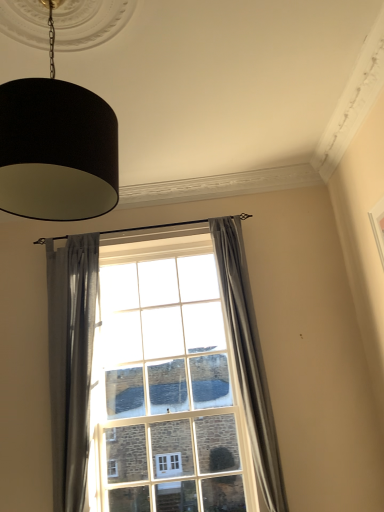
Question: From the image's perspective, is satin gray curtain at left, which is the second curtain in right-to-left order, located beneath gray fabric curtain at center, which is the first curtain in right-to-left order?

Choices:
 (A) no
 (B) yes

Answer: (B)

Question: From a real-world perspective, does satin gray curtain at left, which is counted as the 1th curtain, starting from the left, sit lower than gray fabric curtain at center, which is the first curtain in right-to-left order?

Choices:
 (A) yes
 (B) no

Answer: (B)

Question: Can you confirm if satin gray curtain at left, which is the second curtain in right-to-left order, is shorter than gray fabric curtain at center, placed as the second curtain when sorted from left to right?

Choices:
 (A) yes
 (B) no

Answer: (A)

Question: Can you confirm if satin gray curtain at left, which is counted as the 1th curtain, starting from the left, is thinner than gray fabric curtain at center, which is the first curtain in right-to-left order?

Choices:
 (A) yes
 (B) no

Answer: (A)

Question: Is satin gray curtain at left, which is counted as the 1th curtain, starting from the left, wider than gray fabric curtain at center, which is the first curtain in right-to-left order?

Choices:
 (A) no
 (B) yes

Answer: (A)

Question: Is black fabric lampshade at upper left bigger or smaller than gray fabric curtain at center, placed as the second curtain when sorted from left to right?

Choices:
 (A) small
 (B) big

Answer: (B)

Question: Which is correct: black fabric lampshade at upper left is inside gray fabric curtain at center, placed as the second curtain when sorted from left to right, or outside of it?

Choices:
 (A) inside
 (B) outside

Answer: (B)

Question: From the image's perspective, is black fabric lampshade at upper left positioned above or below gray fabric curtain at center, which is the first curtain in right-to-left order?

Choices:
 (A) below
 (B) above

Answer: (B)

Question: In terms of height, does black fabric lampshade at upper left look taller or shorter compared to gray fabric curtain at center, placed as the second curtain when sorted from left to right?

Choices:
 (A) tall
 (B) short

Answer: (B)

Question: Considering the positions of black fabric lampshade at upper left and clear glass window at center in the image, is black fabric lampshade at upper left wider or thinner than clear glass window at center?

Choices:
 (A) wide
 (B) thin

Answer: (A)

Question: From the image's perspective, relative to clear glass window at center, is black fabric lampshade at upper left above or below?

Choices:
 (A) above
 (B) below

Answer: (A)

Question: Is black fabric lampshade at upper left in front of or behind clear glass window at center in the image?

Choices:
 (A) behind
 (B) front

Answer: (B)

Question: Considering the positions of point (66, 199) and point (97, 365), is point (66, 199) closer or farther from the camera than point (97, 365)?

Choices:
 (A) farther
 (B) closer

Answer: (B)

Question: Would you say clear glass window at center is to the left or to the right of gray fabric curtain at center, which is the first curtain in right-to-left order, in the picture?

Choices:
 (A) right
 (B) left

Answer: (B)

Question: Considering the positions of clear glass window at center and gray fabric curtain at center, which is the first curtain in right-to-left order, in the image, is clear glass window at center taller or shorter than gray fabric curtain at center, which is the first curtain in right-to-left order,?

Choices:
 (A) short
 (B) tall

Answer: (A)